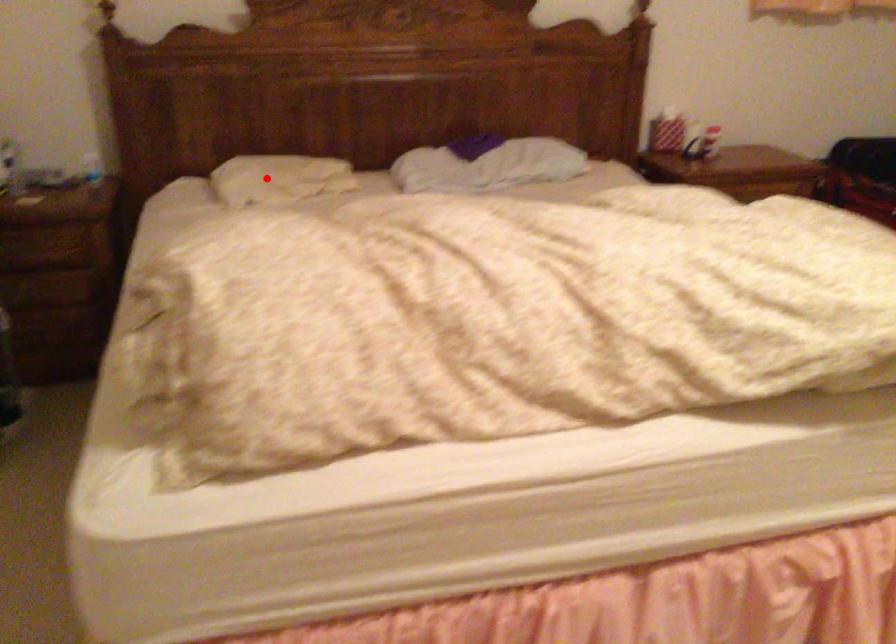
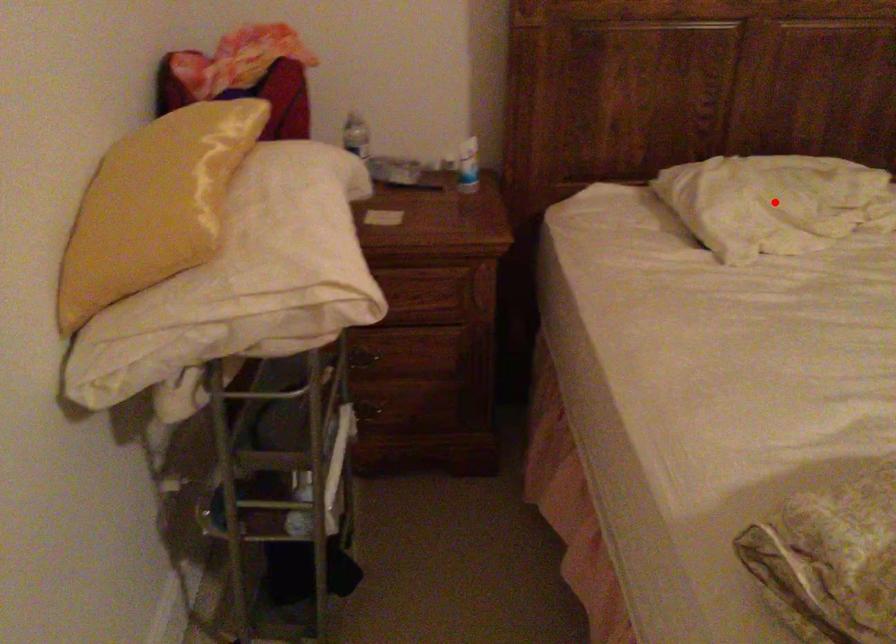
I am providing you with two images of the same scene from different viewpoints. A red point is marked on the first image and another point is marked on the second image. Is the red point in image1 aligned with the point shown in image2?

Yes